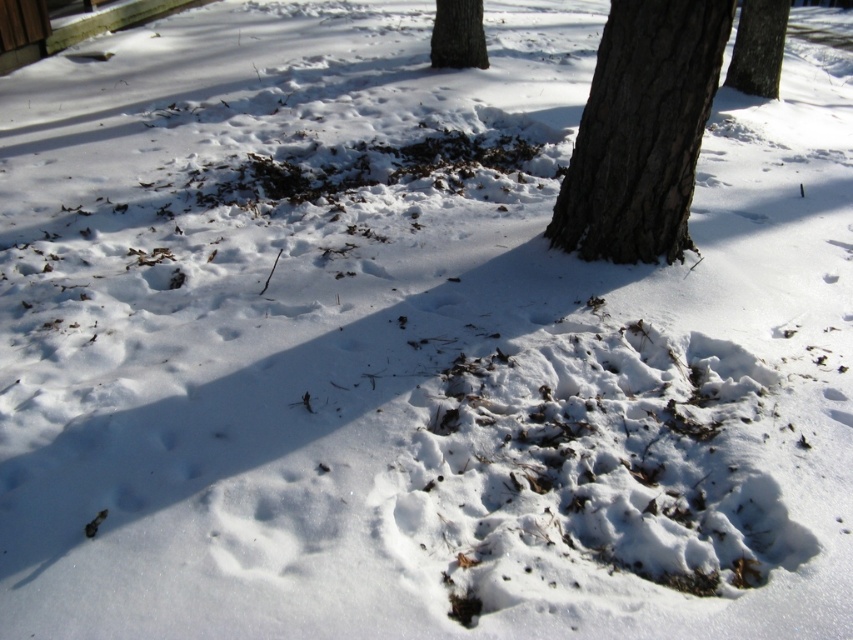
Question: Which point appears farthest from the camera in this image?

Choices:
 (A) (611, 177)
 (B) (770, 35)
 (C) (437, 8)

Answer: (B)

Question: Which point is farther from the camera taking this photo?

Choices:
 (A) (566, 179)
 (B) (457, 19)

Answer: (B)

Question: Does dark brown bark tree at center have a greater width compared to brown rough bark tree at upper center?

Choices:
 (A) yes
 (B) no

Answer: (A)

Question: Which is farther from the brown rough bark tree at center?

Choices:
 (A) brown rough bark tree at upper center
 (B) dark brown bark tree at center

Answer: (B)

Question: Does dark brown bark tree at center have a smaller size compared to brown rough bark tree at upper center?

Choices:
 (A) yes
 (B) no

Answer: (B)

Question: Observing the image, what is the correct spatial positioning of dark brown bark tree at center in reference to brown rough bark tree at center?

Choices:
 (A) below
 (B) above

Answer: (A)